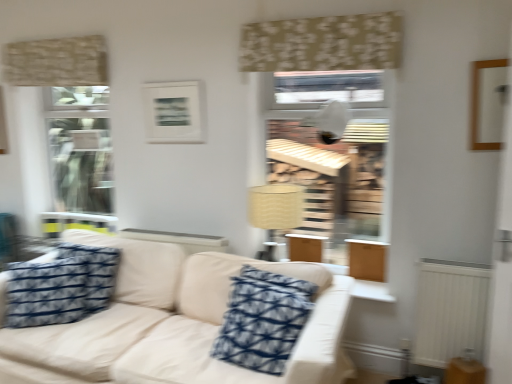
Question: From a real-world perspective, relative to beige floral fabric at upper center, which appears as the 1th curtain when viewed from the front, is blue printed fabric pillow at center, placed as the 1th pillow when sorted from right to left, vertically above or below?

Choices:
 (A) above
 (B) below

Answer: (B)

Question: Is blue printed fabric pillow at center, which appears as the second pillow when viewed from the left, spatially inside beige floral fabric at upper center, which is the first curtain in right-to-left order, or outside of it?

Choices:
 (A) outside
 (B) inside

Answer: (A)

Question: Which object is positioned farthest from the wooden table at lower right?

Choices:
 (A) beige floral fabric at upper center, which is the first curtain in right-to-left order
 (B) wooden picture frame at upper right, the first picture frame when ordered from right to left
 (C) beige textured curtain at upper left, arranged as the second curtain when viewed from the right
 (D) white matte picture frame at upper center, which is the 2th picture frame from right to left
 (E) beige fabric lampshade at center

Answer: (C)

Question: Estimate the real-world distances between objects in this image. Which object is farther from the beige fabric couch at center?

Choices:
 (A) wooden table at lower right
 (B) white matte picture frame at upper center, which ranks as the first picture frame in back-to-front order
 (C) wooden picture frame at upper right, which is counted as the second picture frame, starting from the back
 (D) beige floral fabric at upper center, which is the 2th curtain in back-to-front order
 (E) beige textured curtain at upper left, arranged as the second curtain when viewed from the right

Answer: (C)